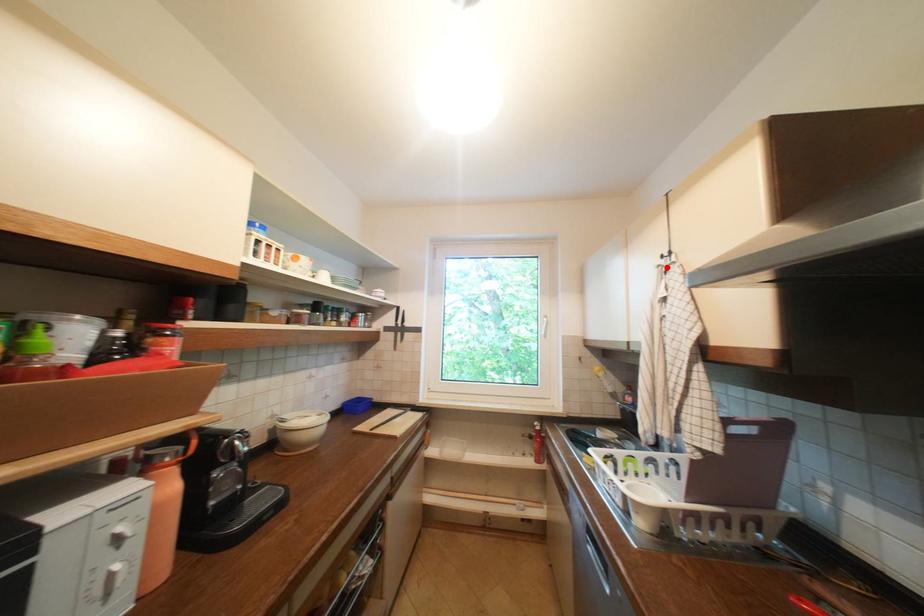
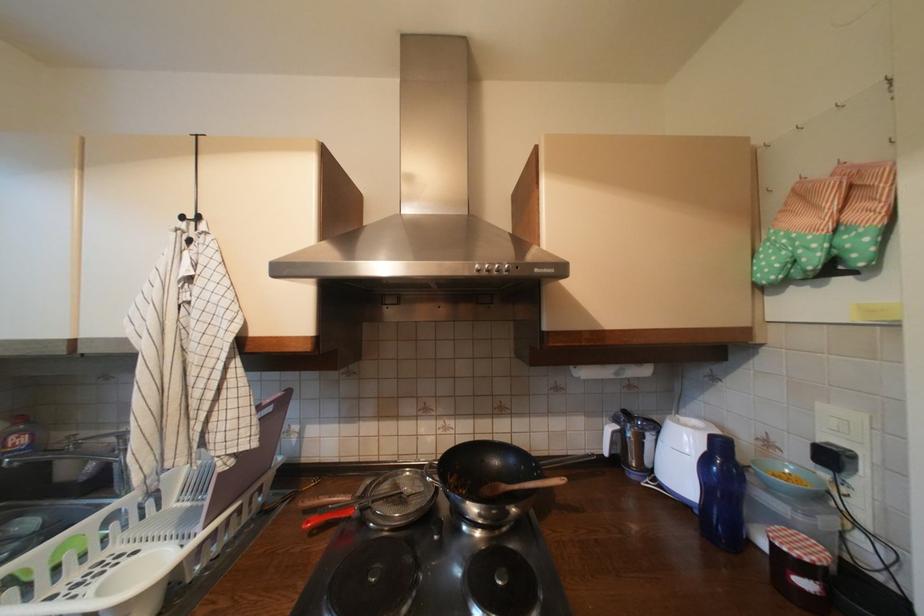
Locate, in the second image, the point that corresponds to the highlighted location in the first image.

(187, 230)